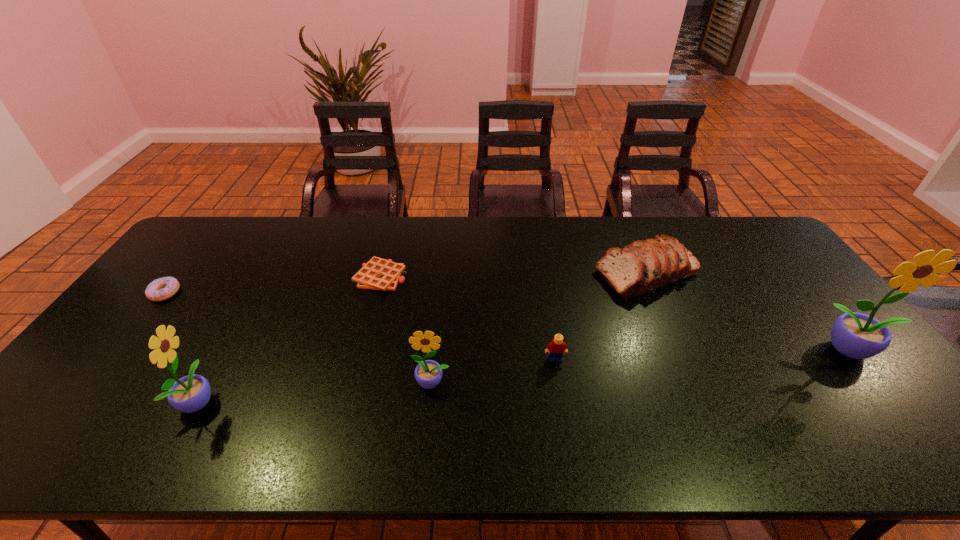
Find the location of a particular element. the second shortest sunflower is located at coordinates (191, 393).

Identify the location of the second tallest object. (191, 393).

At what (x,y) coordinates should I click in order to perform the action: click on the shortest sunflower. Please return your answer as a coordinate pair (x, y). The width and height of the screenshot is (960, 540). Looking at the image, I should click on (428, 373).

At what (x,y) coordinates should I click in order to perform the action: click on the fourth object from left to right. Please return your answer as a coordinate pair (x, y). This screenshot has width=960, height=540. Looking at the image, I should click on (428, 373).

In order to click on the tallest object in this screenshot , I will do (x=855, y=335).

You are a GUI agent. You are given a task and a screenshot of the screen. Output one action in this format:
    pyautogui.click(x=<x>, y=<y>)
    Task: Click on the tallest sunflower
    The width and height of the screenshot is (960, 540).
    Given the screenshot: What is the action you would take?
    pyautogui.click(x=855, y=335)

What are the coordinates of `the second object from right to left` in the screenshot? It's located at (642, 266).

What are the coordinates of `the fourth tallest object` in the screenshot? It's located at point(642,266).

Locate an element on the screen. This screenshot has height=540, width=960. the leftmost object is located at coordinates (160, 289).

Find the location of `waffle`. waffle is located at coordinates pos(378,274).